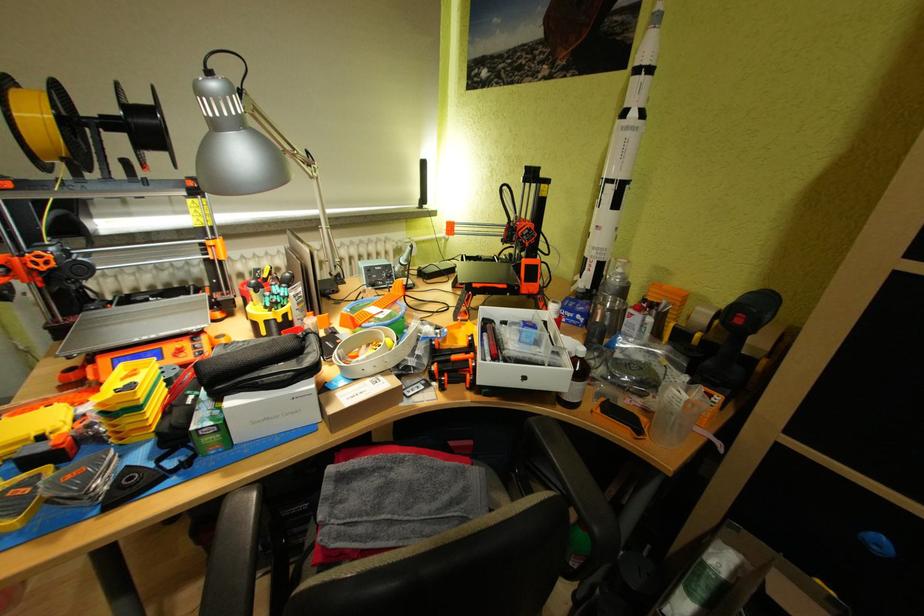
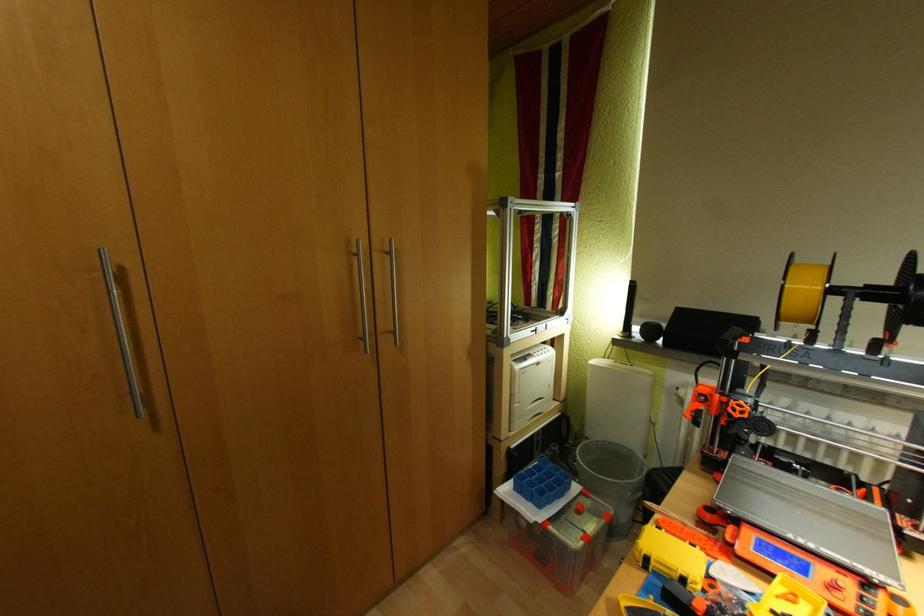
Question: Based on the continuous images, in which direction is the camera rotating? Reply with the corresponding letter.

Choices:
 (A) Left
 (B) Right
 (C) Up
 (D) Down

Answer: (A)